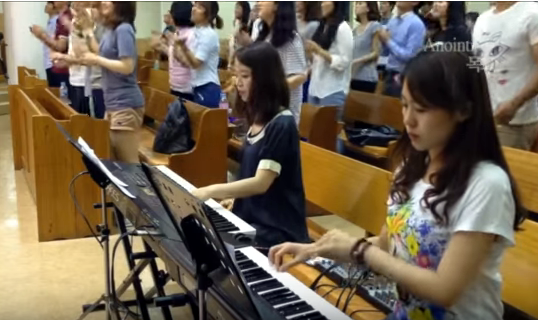
Find the location of a particular element. The width and height of the screenshot is (538, 320). sheet music stand is located at coordinates (99, 174), (196, 240).